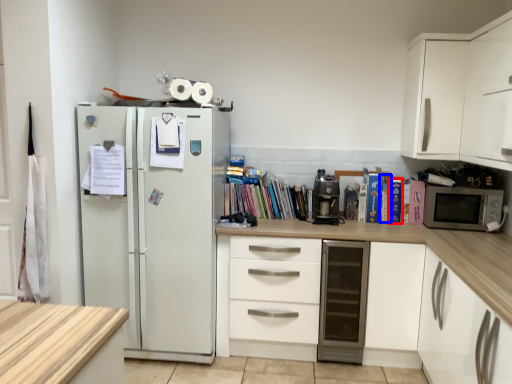
Question: Which point is further to the camera, paperback book (highlighted by a red box) or paperback book (highlighted by a blue box)?

Choices:
 (A) paperback book
 (B) paperback book

Answer: (B)